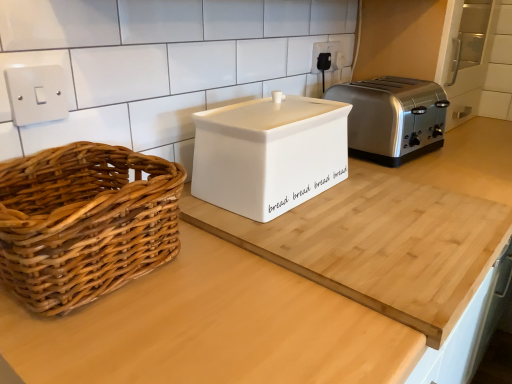
What are the coordinates of `free space in front of white ceramic bread bin at center` in the screenshot? It's located at (335, 234).